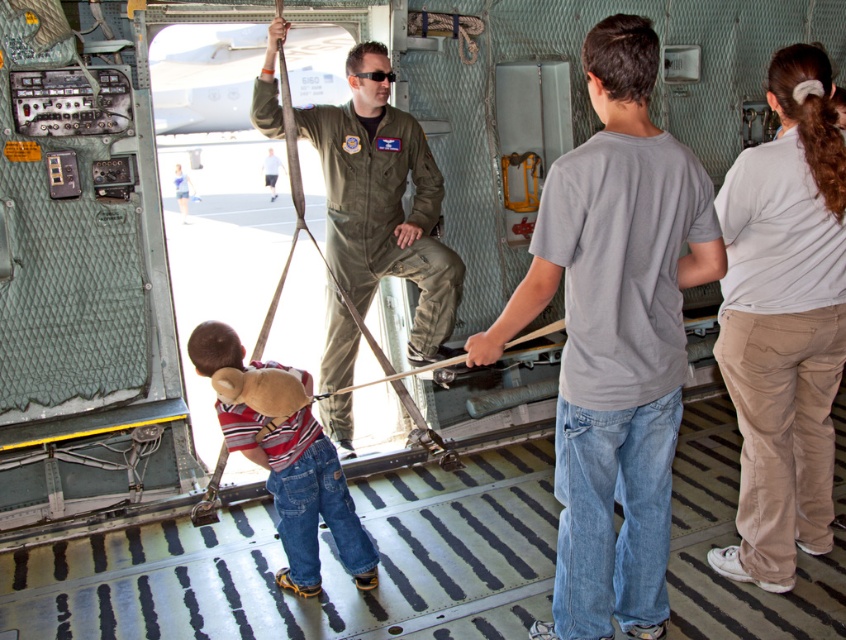
You are inside the military aircraft cargo hold and need to locate the white cotton shirt at upper right. Based on the coordinates provided in the description, where should you look relative to the open door?

The white cotton shirt at upper right is located at point coordinates 0.503 on the x axis and 0.928 on the y axis, so you should look towards the upper right direction from the open door to find it.

You are standing inside the military aircraft cargo hold and see two points marked on the floor. The first point is at coordinates point (757, 502) and the second is at point (317, 458). Which point is closer to the open door of the aircraft?

Point (757, 502) is in front of point (317, 458), so it is closer to the open door of the aircraft.